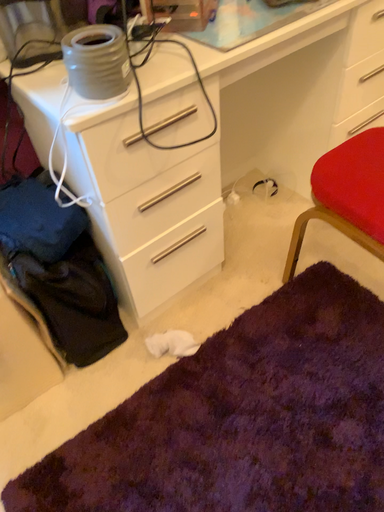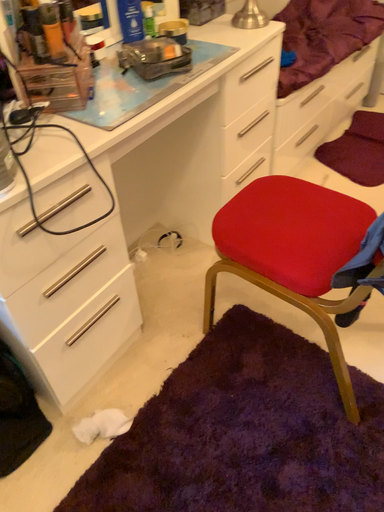
Question: How did the camera likely rotate when shooting the video?

Choices:
 (A) rotated right
 (B) rotated left

Answer: (A)